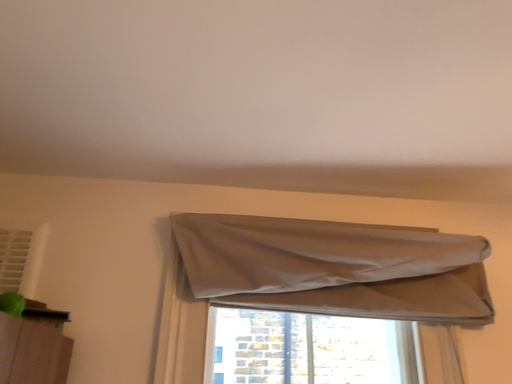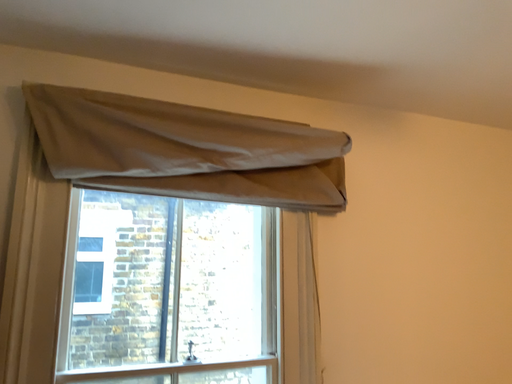
Question: How did the camera likely rotate when shooting the video?

Choices:
 (A) rotated upward
 (B) rotated downward

Answer: (B)